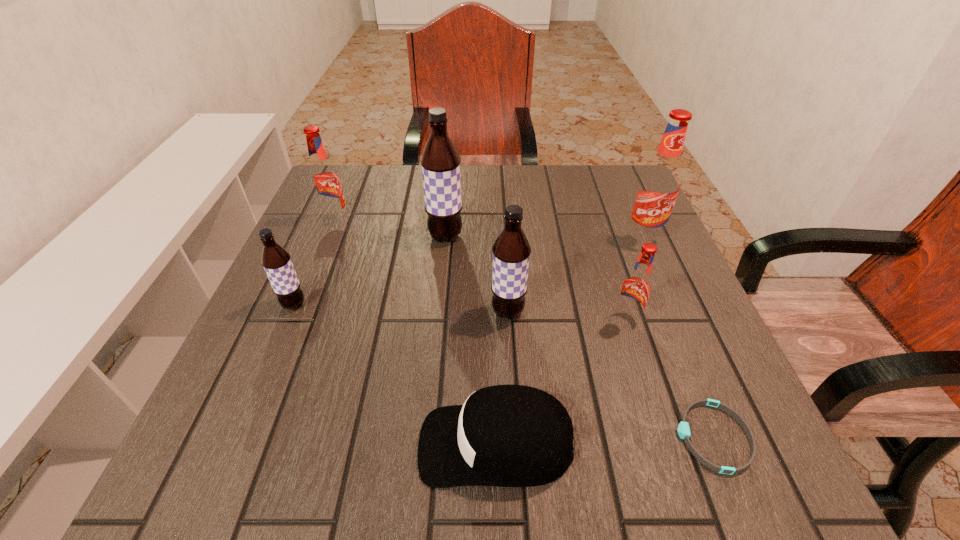
This screenshot has height=540, width=960. I want to click on cap, so click(505, 435).

This screenshot has width=960, height=540. I want to click on black cap, so click(505, 435).

Identify the location of gray wristband. (683, 429).

Where is `the shortest object`? the shortest object is located at coordinates (683, 429).

You are a GUI agent. You are given a task and a screenshot of the screen. Output one action in this format:
    pyautogui.click(x=<x>, y=<y>)
    Task: Click on the vacant region located 0.110m on the back of the rightmost red root beer
    The height and width of the screenshot is (540, 960).
    Given the screenshot: What is the action you would take?
    pyautogui.click(x=627, y=202)

What are the coordinates of `vacant space located on the back of the fourth root beer from right to left` in the screenshot? It's located at (452, 166).

Identify the location of vacant space located 0.310m on the front of the leftmost red root beer. (292, 330).

You are a GUI agent. You are given a task and a screenshot of the screen. Output one action in this format:
    pyautogui.click(x=<x>, y=<y>)
    Task: Click on the free space located 0.180m on the right of the third root beer from right to left
    This screenshot has height=540, width=960.
    Given the screenshot: What is the action you would take?
    pyautogui.click(x=618, y=312)

In order to click on free space located 0.210m on the right of the smallest brown root beer in this screenshot , I will do `click(413, 305)`.

Identify the location of vacant space located 0.290m on the front of the second red root beer from left to right. (681, 490).